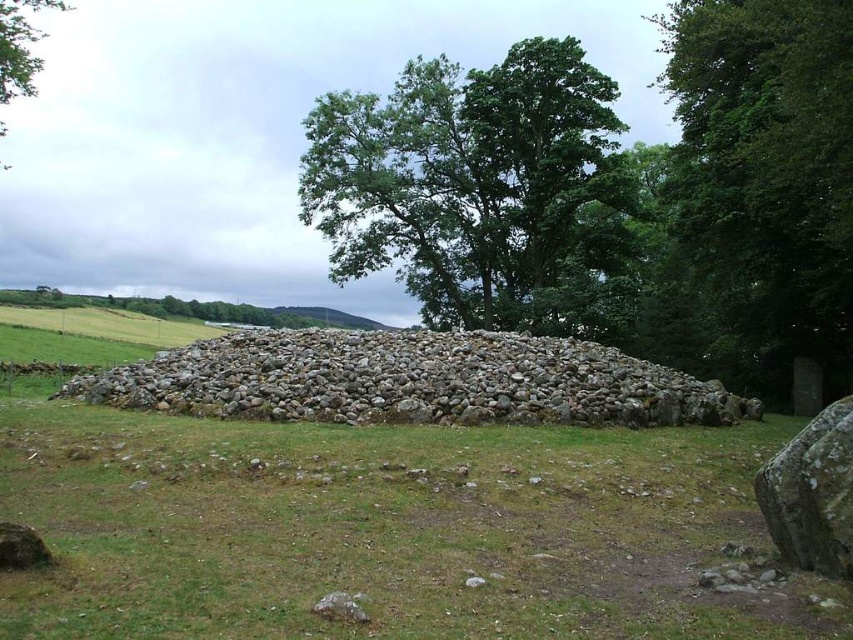
You are standing in the rural landscape looking at the gray stone pile at center and the green leafy tree at upper left. Which object is positioned higher up in the image?

The green leafy tree at upper left is positioned higher up in the image than the gray stone pile at center.

You are planning to place a small garden statue that requires a base wider than the gray stone pile at center. Can the base of the statue be placed on the green leafy tree at right?

The green leafy tree at right is larger in size than the gray stone pile at center, but trees cannot support heavy bases. Therefore, the statue cannot be placed there.

You are standing in the rural landscape looking at the green leafy tree at right and the gray stone pile at center. Which object is positioned higher relative to the other?

The green leafy tree at right is located above the gray stone pile at center, so it is positioned higher.